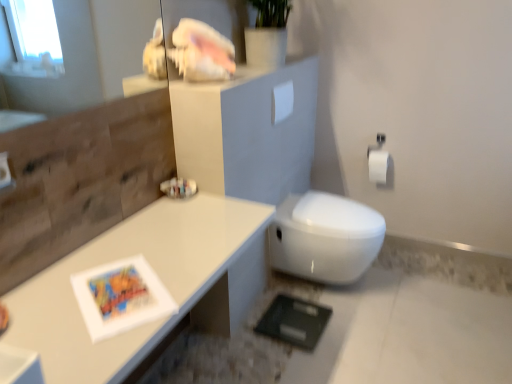
Question: Is white glossy bidet at center bigger or smaller than white glossy shell at upper center?

Choices:
 (A) big
 (B) small

Answer: (A)

Question: Which is correct: white glossy bidet at center is inside white glossy shell at upper center, or outside of it?

Choices:
 (A) inside
 (B) outside

Answer: (B)

Question: Estimate the real-world distances between objects in this image. Which object is farther from the white matte toilet paper at right, which is the 1th toilet paper in right-to-left order?

Choices:
 (A) white glossy shell at upper center
 (B) white matte toilet paper at upper center, which is the 2th toilet paper in back-to-front order
 (C) white glossy bidet at center
 (D) white glossy table at upper left

Answer: (D)

Question: Based on their relative distances, which object is nearer to the white glossy shell at upper center?

Choices:
 (A) white glossy table at upper left
 (B) white matte toilet paper at upper center, which is the 2th toilet paper in back-to-front order
 (C) white matte toilet paper at right, the second toilet paper in the front-to-back sequence
 (D) white glossy bidet at center

Answer: (B)